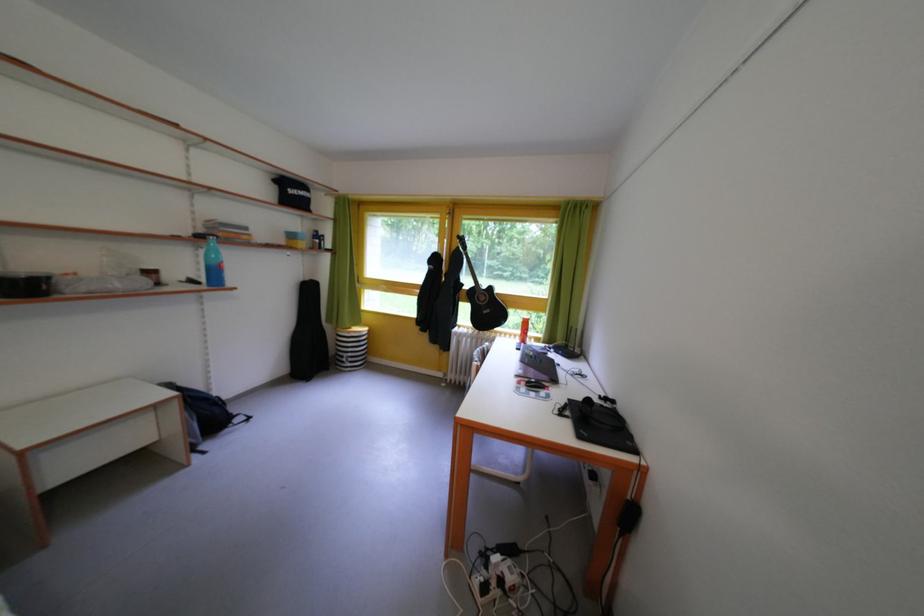
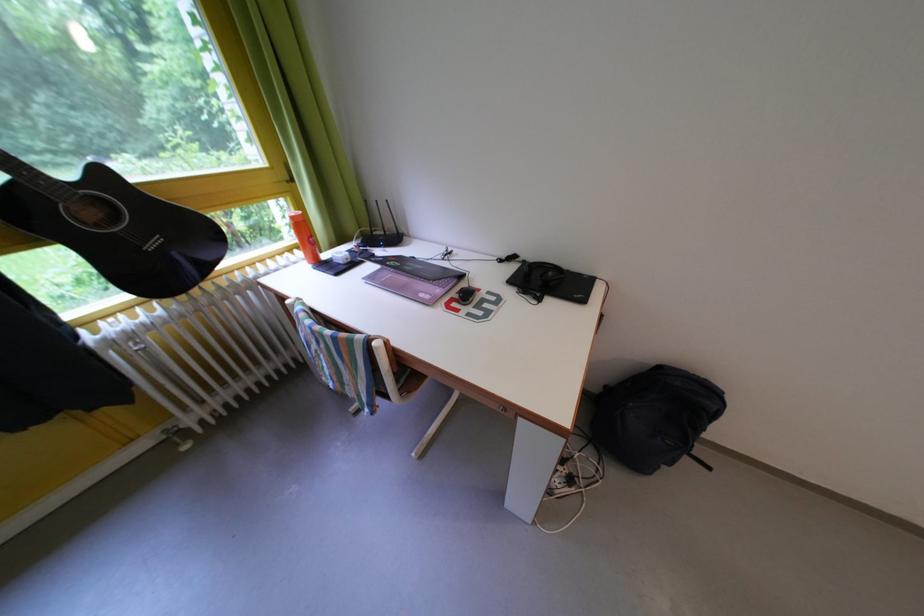
Find the pixel in the second image that matches (469,341) in the first image.

(140, 342)